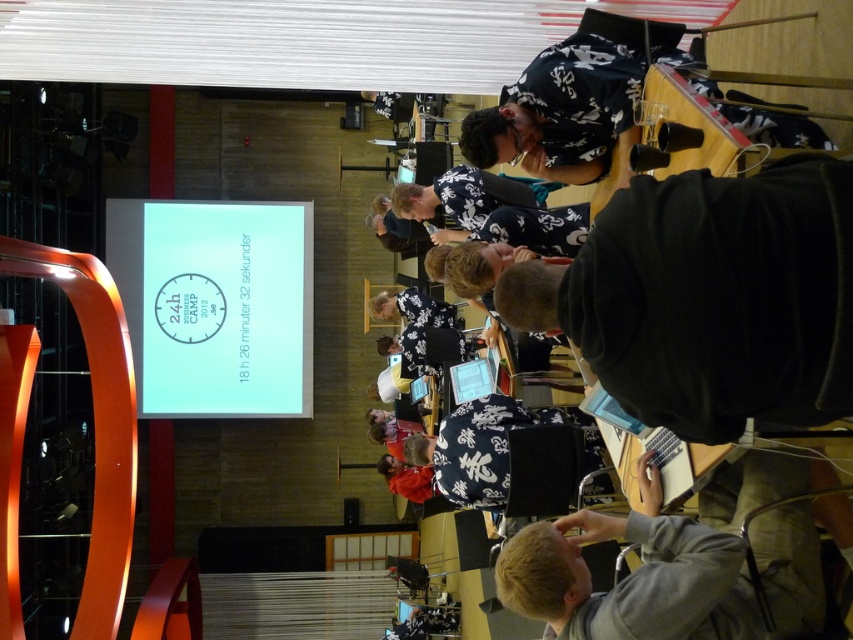
You are a photographer standing to the right of the long table. You want to take a photo of both the floral fabric shirt at center and the matte plastic screen at center. Which object should you position closer to the left side of your camera frame?

You should position the floral fabric shirt at center closer to the left side of your camera frame because it is already to the left of the matte plastic screen at center.

You are standing at the center of the conference room and want to reach both the floral fabric cap at center and the red hoodie at center. Since you can only move in a straight line, which one would you reach first?

The floral fabric cap at center and the red hoodie at center are both at the same distance from you since they are both at center, so you would reach them at the same time.

Where is the red hoodie at center located in the image?

The red hoodie at center is located at point 0.748 on the x axis and 0.477 on the y axis.